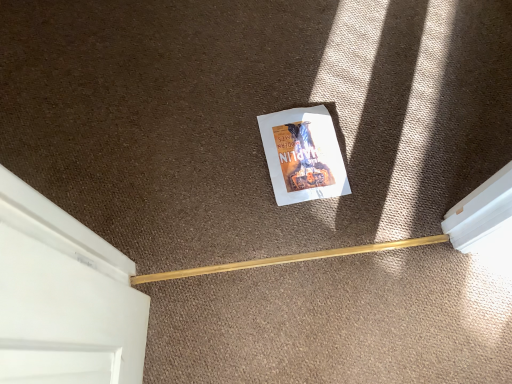
The image size is (512, 384). Find the location of `free space in front of matte paper book at center`. free space in front of matte paper book at center is located at coordinates (313, 237).